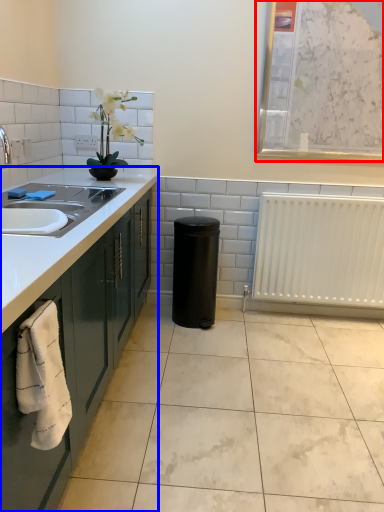
Question: Among these objects, which one is nearest to the camera, bulletin board (highlighted by a red box) or countertop (highlighted by a blue box)?

Choices:
 (A) bulletin board
 (B) countertop

Answer: (B)